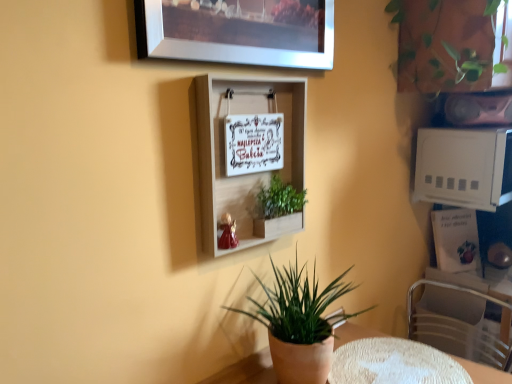
Question: Does metallic silver swivel chair at lower right have a lesser width compared to white textured table at lower center?

Choices:
 (A) yes
 (B) no

Answer: (A)

Question: Are metallic silver swivel chair at lower right and white textured table at lower center located far from each other?

Choices:
 (A) no
 (B) yes

Answer: (A)

Question: Is metallic silver swivel chair at lower right to the right of white textured table at lower center from the viewer's perspective?

Choices:
 (A) no
 (B) yes

Answer: (B)

Question: Is white textured table at lower center at the back of metallic silver swivel chair at lower right?

Choices:
 (A) yes
 (B) no

Answer: (B)

Question: Considering the relative positions of metallic silver swivel chair at lower right and white textured table at lower center in the image provided, is metallic silver swivel chair at lower right in front of white textured table at lower center?

Choices:
 (A) no
 (B) yes

Answer: (A)

Question: In terms of height, does green matte plant pot at lower center, which is the third houseplant from top to bottom, look taller or shorter compared to green matte plant at center, placed as the second houseplant when sorted from top to bottom?

Choices:
 (A) short
 (B) tall

Answer: (B)

Question: Is green matte plant pot at lower center, the 1th houseplant ordered from the bottom, spatially inside green matte plant at center, which is counted as the third houseplant, starting from the right, or outside of it?

Choices:
 (A) outside
 (B) inside

Answer: (A)

Question: From the image's perspective, is green matte plant pot at lower center, the 1th houseplant ordered from the bottom, above or below green matte plant at center, which is counted as the third houseplant, starting from the right?

Choices:
 (A) above
 (B) below

Answer: (B)

Question: In terms of width, does green matte plant pot at lower center, the 1th houseplant ordered from the bottom, look wider or thinner when compared to green matte plant at center, placed as the second houseplant when sorted from top to bottom?

Choices:
 (A) wide
 (B) thin

Answer: (A)

Question: From a real-world perspective, is white wooden shelf at center above or below metallic silver picture frame at upper center?

Choices:
 (A) above
 (B) below

Answer: (B)

Question: Is white wooden shelf at center inside the boundaries of metallic silver picture frame at upper center, or outside?

Choices:
 (A) outside
 (B) inside

Answer: (A)

Question: Would you say white wooden shelf at center is to the left or to the right of metallic silver picture frame at upper center in the picture?

Choices:
 (A) right
 (B) left

Answer: (B)

Question: Relative to metallic silver picture frame at upper center, is white wooden shelf at center in front or behind?

Choices:
 (A) behind
 (B) front

Answer: (A)

Question: Is green matte plant at center, which is counted as the 2th houseplant, starting from the bottom, bigger or smaller than green leafy plant at upper right, the first houseplant viewed from the top?

Choices:
 (A) big
 (B) small

Answer: (B)

Question: From the image's perspective, is green matte plant at center, the first houseplant when ordered from left to right, located above or below green leafy plant at upper right, which is counted as the third houseplant, starting from the bottom?

Choices:
 (A) above
 (B) below

Answer: (B)